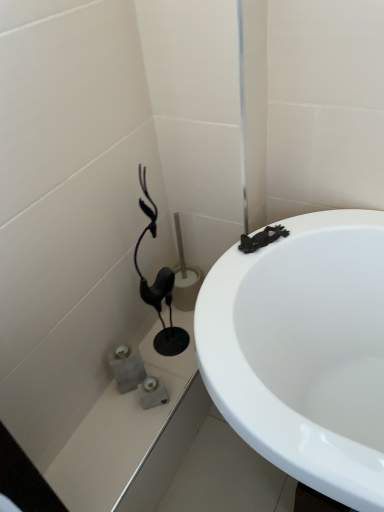
The image size is (384, 512). I want to click on black matte toilet brush at lower left, so click(159, 286).

What do you see at coordinates (159, 286) in the screenshot?
I see `black matte toilet brush at lower left` at bounding box center [159, 286].

At what (x,y) coordinates should I click in order to perform the action: click on black matte toilet brush at lower left. Please return your answer as a coordinate pair (x, y). The width and height of the screenshot is (384, 512). Looking at the image, I should click on tap(159, 286).